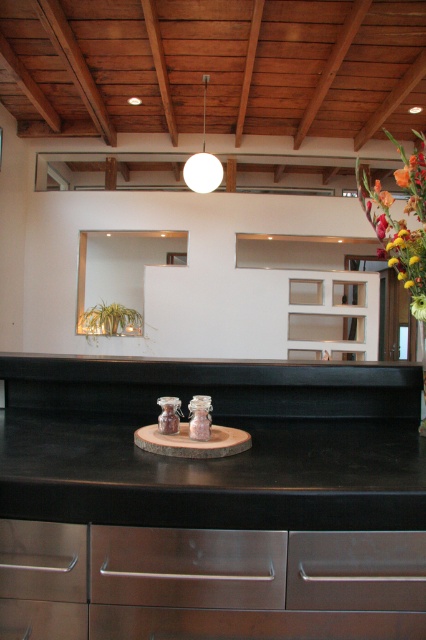
Question: Does black granite countertop at center appear under stainless steel drawer at lower left?

Choices:
 (A) yes
 (B) no

Answer: (B)

Question: Considering the real-world distances, which object is farthest from the black matte counter top at center?

Choices:
 (A) stainless steel drawer at center
 (B) satin brown wood drawer at lower left
 (C) black granite countertop at center
 (D) stainless steel drawer at lower left

Answer: (B)

Question: Among these points, which one is nearest to the camera?

Choices:
 (A) pyautogui.click(x=224, y=474)
 (B) pyautogui.click(x=77, y=627)
 (C) pyautogui.click(x=250, y=106)
 (D) pyautogui.click(x=97, y=618)

Answer: (B)

Question: Is black matte counter top at center below stainless steel drawer at lower left?

Choices:
 (A) yes
 (B) no

Answer: (B)

Question: Which object appears closest to the camera in this image?

Choices:
 (A) satin brown wood drawer at lower left
 (B) satin silver drawer at lower center

Answer: (B)

Question: Is black granite countertop at center to the left of stainless steel drawer at center from the viewer's perspective?

Choices:
 (A) yes
 (B) no

Answer: (A)